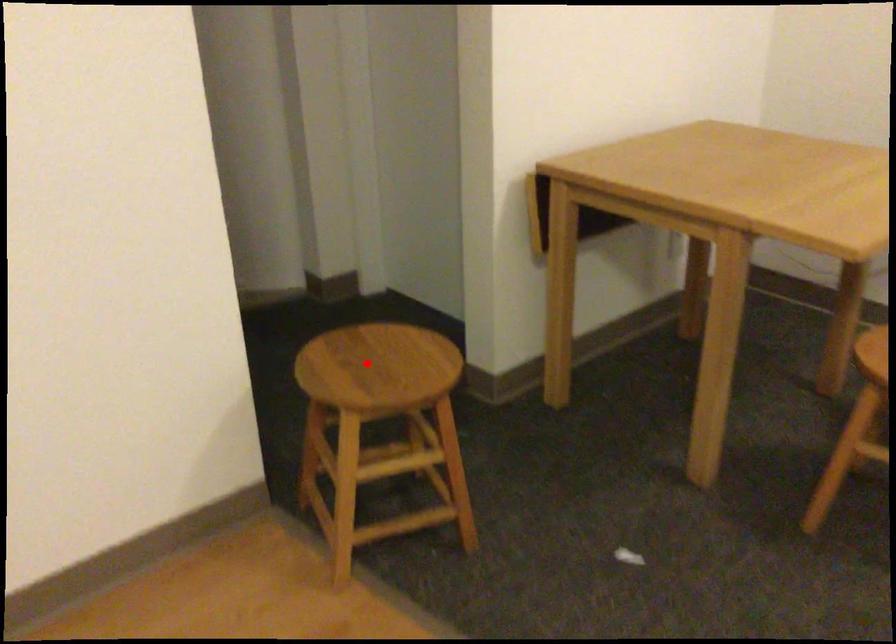
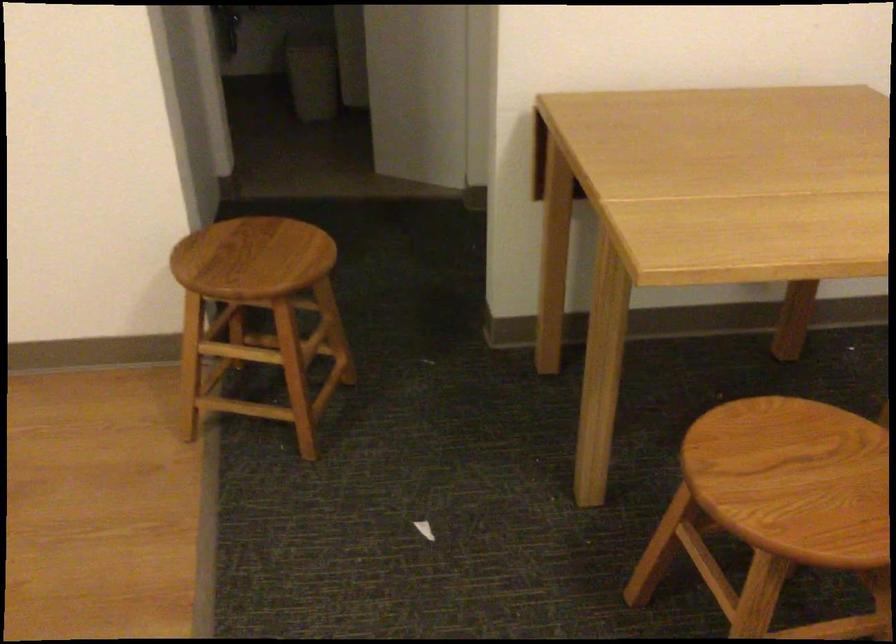
Find the pixel in the second image that matches the highlighted location in the first image.

(255, 252)